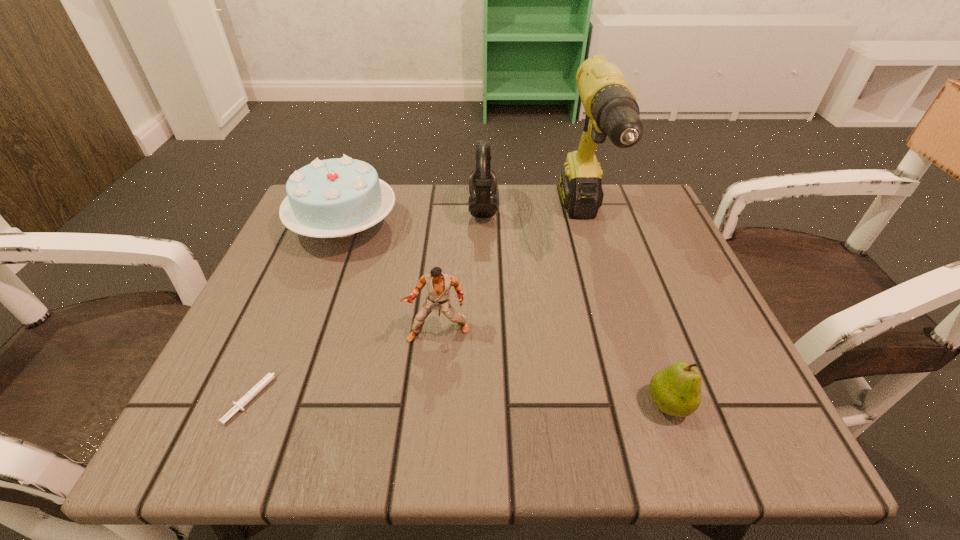
At what (x,y) coordinates should I click in order to perform the action: click on blank area located 0.370m on the front of the birthday cake. Please return your answer as a coordinate pair (x, y). The width and height of the screenshot is (960, 540). Looking at the image, I should click on (269, 428).

Where is `vacant space located on the front-facing side of the fourth farthest object`? vacant space located on the front-facing side of the fourth farthest object is located at coordinates (431, 409).

This screenshot has width=960, height=540. Identify the location of free space located 0.230m on the back of the pear. (627, 284).

This screenshot has height=540, width=960. Identify the location of vacant area situated on the back of the shortest object. (328, 223).

This screenshot has width=960, height=540. I want to click on drill located in the far edge section of the desktop, so click(611, 108).

Find the location of `headset that is positioned at the far edge`. headset that is positioned at the far edge is located at coordinates (482, 202).

At what (x,y) coordinates should I click in order to perform the action: click on birthday cake positioned at the far edge. Please return your answer as a coordinate pair (x, y). This screenshot has height=540, width=960. Looking at the image, I should click on (339, 197).

In order to click on pear that is at the near edge in this screenshot , I will do `click(676, 390)`.

This screenshot has height=540, width=960. Find the location of `syringe at the near edge`. syringe at the near edge is located at coordinates (238, 405).

You are a GUI agent. You are given a task and a screenshot of the screen. Output one action in this format:
    pyautogui.click(x=<x>, y=<y>)
    Task: Click on the birthday cake at the left edge
    
    Given the screenshot: What is the action you would take?
    pyautogui.click(x=339, y=197)